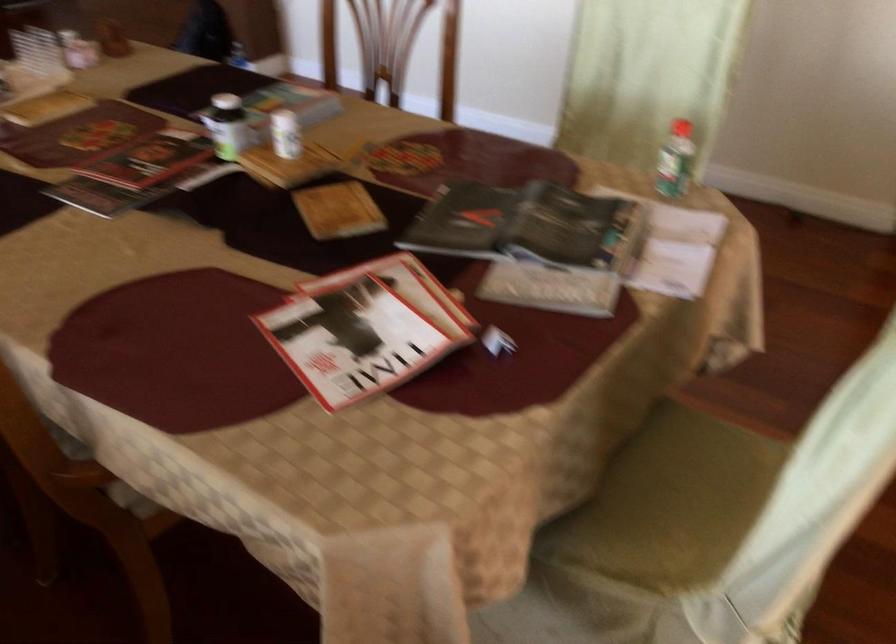
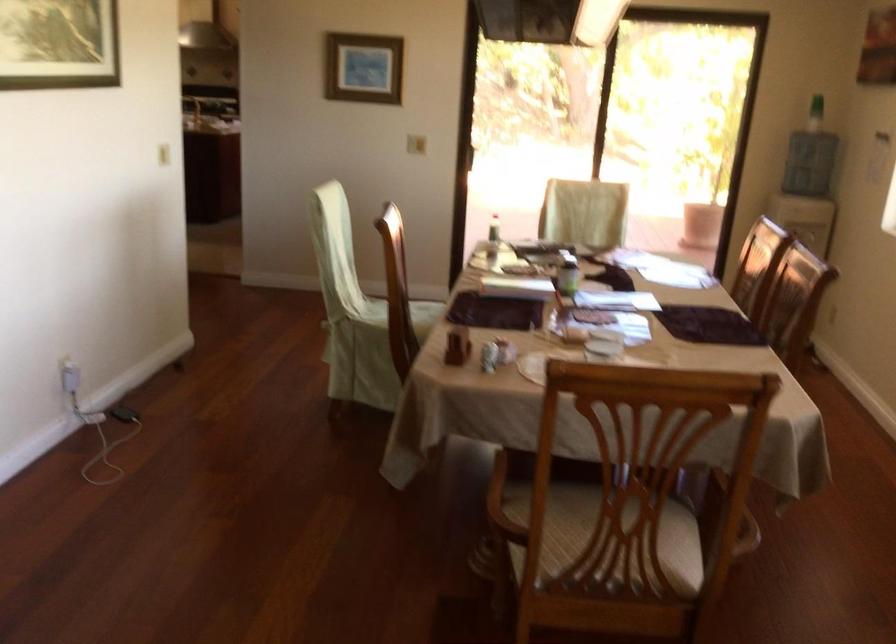
Where in the second image is the point corresponding to the point at 235,117 from the first image?

(566, 272)